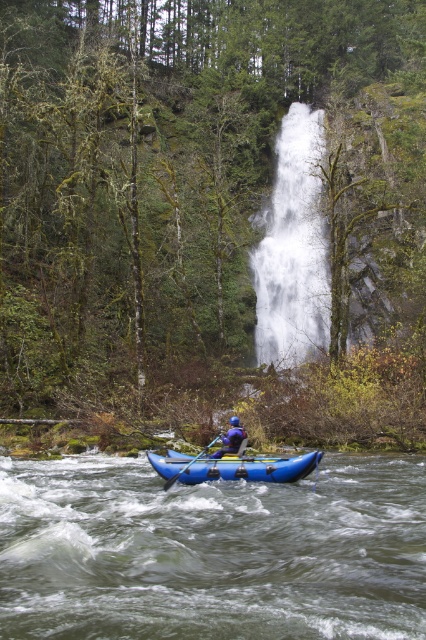
Which is in front, point (256, 301) or point (196, 458)?

Positioned in front is point (196, 458).

Who is shorter, white frothy water at center or blue rubber paddle at center?

blue rubber paddle at center is shorter.

Between point (307, 288) and point (173, 483), which one is positioned behind?

The point (307, 288) is behind.

The image size is (426, 640). Identify the location of white frothy water at center. (293, 248).

Which is behind, point (319, 177) or point (276, 476)?

Point (319, 177)

Does white frothy water at center have a greater width compared to blue rubber raft at center?

Yes, white frothy water at center is wider than blue rubber raft at center.

Is point (279, 349) closer to camera compared to point (226, 467)?

No, (279, 349) is behind (226, 467).

The height and width of the screenshot is (640, 426). Identify the location of white frothy water at center. (293, 248).

Is blue rubber raft at lower center further to the viewer compared to white frothy water at center?

No, it is in front of white frothy water at center.

Does point (236, 608) come closer to viewer compared to point (287, 115)?

Yes.

Where is `blue rubber raft at lower center`? The width and height of the screenshot is (426, 640). blue rubber raft at lower center is located at coordinates (212, 552).